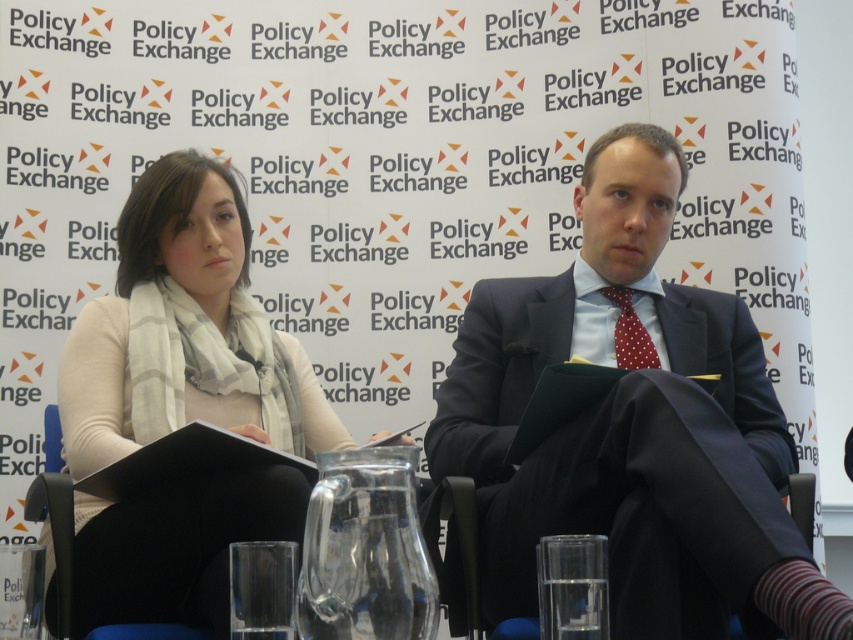
Is the position of matte black suit at center more distant than that of polka dot silk tie at center?

That is False.

Who is more distant from viewer, (x=625, y=604) or (x=606, y=291)?

Positioned behind is point (x=606, y=291).

Locate an element on the screen. matte black suit at center is located at coordinates (631, 428).

Which is more to the left, black fabric chair at center or polka dot silk tie at center?

black fabric chair at center is more to the left.

Which is behind, point (476, 524) or point (639, 339)?

The point (639, 339) is behind.

Image resolution: width=853 pixels, height=640 pixels. What are the coordinates of `black fabric chair at center` in the screenshot? It's located at (465, 541).

Who is higher up, white wool scarf at center or polka dot silk tie at center?

Positioned higher is polka dot silk tie at center.

The height and width of the screenshot is (640, 853). Find the location of `white wool scarf at center`. white wool scarf at center is located at coordinates pos(184,332).